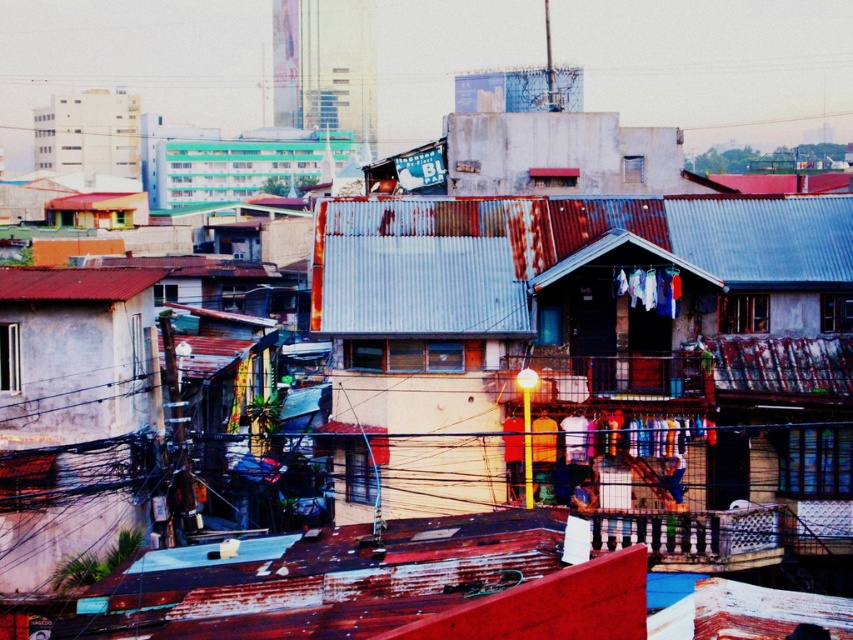
Is rusty corrugated metal hut at center above metallic wire at upper center?

Actually, rusty corrugated metal hut at center is below metallic wire at upper center.

Which is above, rusty corrugated metal hut at center or metallic wire at upper center?

Positioned higher is metallic wire at upper center.

Where is `rusty corrugated metal hut at center`? This screenshot has height=640, width=853. rusty corrugated metal hut at center is located at coordinates click(590, 349).

Which is above, rusty corrugated metal roof at center or teal plastic building at upper center?

teal plastic building at upper center is higher up.

Who is positioned more to the right, rusty corrugated metal roof at center or teal plastic building at upper center?

rusty corrugated metal roof at center

Looking at this image, who is more forward, (383, 276) or (189, 152)?

Point (383, 276) is in front.

Where is `rusty corrugated metal roof at center`? This screenshot has width=853, height=640. rusty corrugated metal roof at center is located at coordinates click(550, 253).

Which of these two, teal plastic building at upper center or metallic wire at upper center, stands shorter?

metallic wire at upper center

Does teal plastic building at upper center have a lesser width compared to metallic wire at upper center?

Yes.

Who is more forward, (245,186) or (160,70)?

Positioned in front is point (245,186).

This screenshot has width=853, height=640. I want to click on teal plastic building at upper center, so click(x=238, y=164).